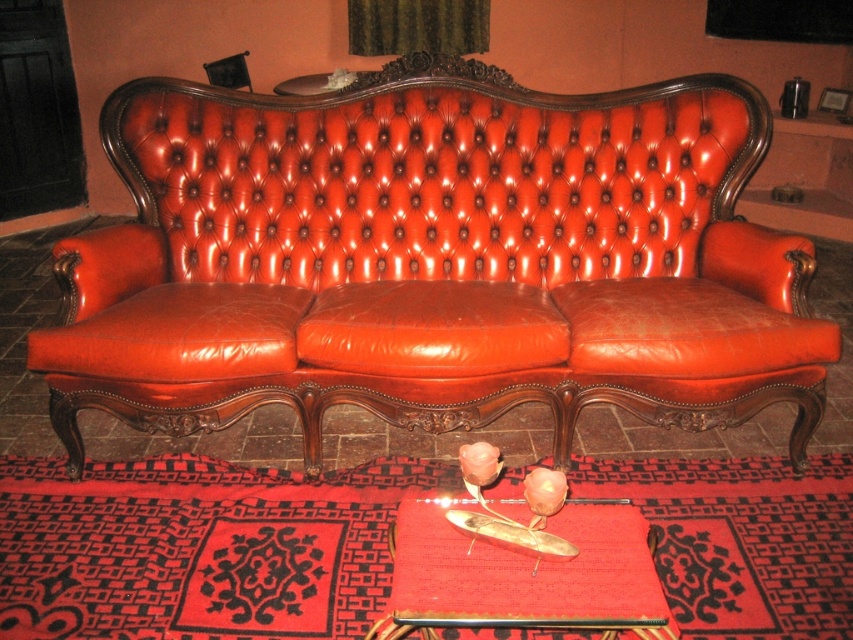
You are standing in the living room and want to sit on the shiny leather couch at center. Based on the coordinates provided, can you determine if the point marked at (434, 259) is directly on the couch?

Yes, the point marked at (434, 259) is directly on the shiny leather couch at center as stated in the description.

You are standing in a living room and want to place a new rug under the shiny leather couch at center. The rug you have is 1.2 meters wide. Based on the coordinates provided, can the rug fit perfectly under the couch?

The coordinates of the shiny leather couch at center are at point (x=434, y=259). However, without knowing the dimensions of the couch itself, it is impossible to determine if the rug will fit perfectly under it.